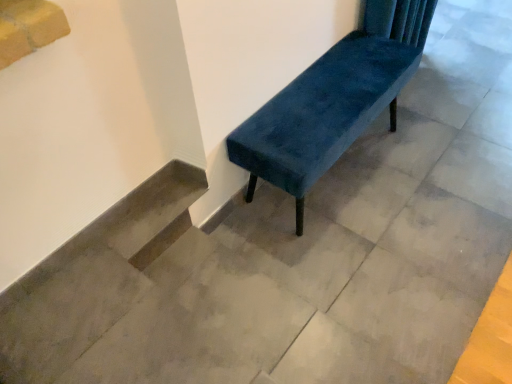
In order to face velvet blue bench at center, should I rotate leftwards or rightwards?

It's best to rotate right around 10.536 degrees.

Find the location of a particular element. Image resolution: width=512 pixels, height=384 pixels. velvet blue bench at center is located at coordinates (333, 100).

The height and width of the screenshot is (384, 512). What do you see at coordinates (333, 100) in the screenshot?
I see `velvet blue bench at center` at bounding box center [333, 100].

Measure the distance between point (381, 110) and camera.

1.82 meters.

What are the coordinates of `velvet blue bench at center` in the screenshot? It's located at (333, 100).